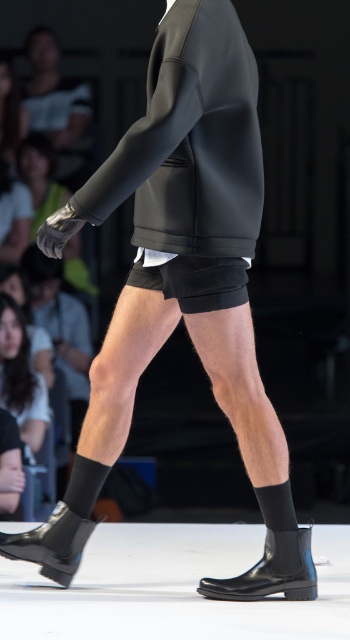
You are a photographer standing at the camera position. You need to adjust your focus to capture a sharp image of the point at coordinates point (177, 227). What is the minimum distance you should set your camera focus to ensure the point is in focus?

The minimum distance you should set your camera focus is 3.64 meters because the distance of point (177, 227) from the camera is 3.64 meters.

You are a photographer standing at the back of the runway. You want to take a photo of both the black leather boot at lower center and the black rubber boot at lower left in the same frame. The minimum distance between the two objects to fit in your camera frame is 30 inches. Can you capture both in one shot?

The distance between the black leather boot at lower center and the black rubber boot at lower left is 30.74 inches, which is just over the minimum required 30 inches. Therefore, you can capture both in one shot.

You are a photographer standing at the origin point of the coordinate system. You see two points in the image, point (306, 588) and point (56, 572). Which point is closer to you?

Point (306, 588) is in front of point (56, 572), so it is closer to you.